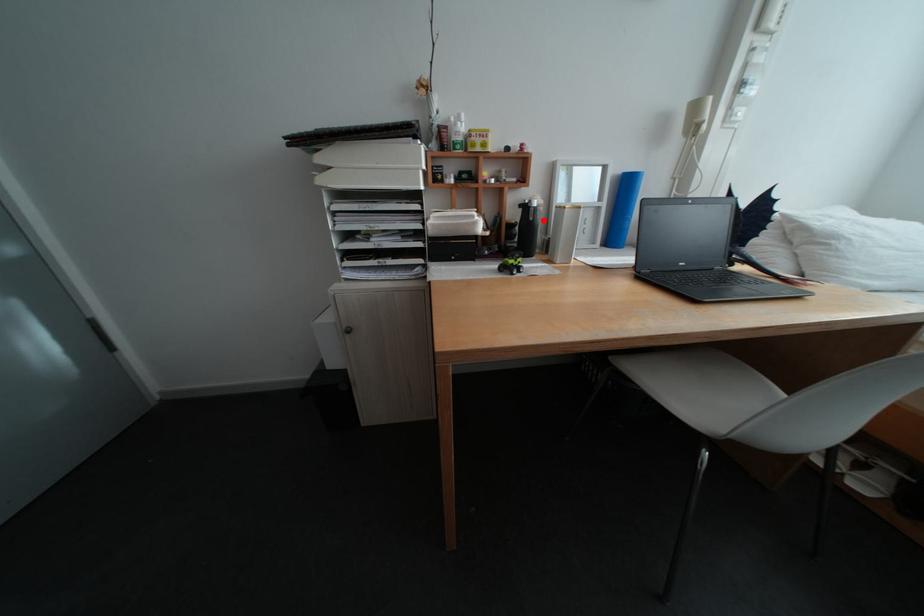
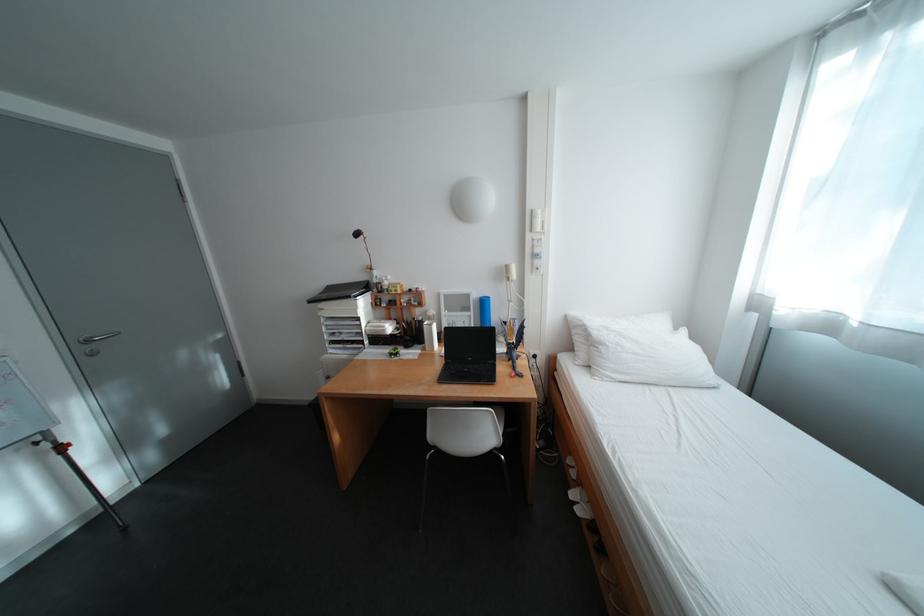
Locate, in the second image, the point that corresponds to the highlighted location in the first image.

(430, 326)